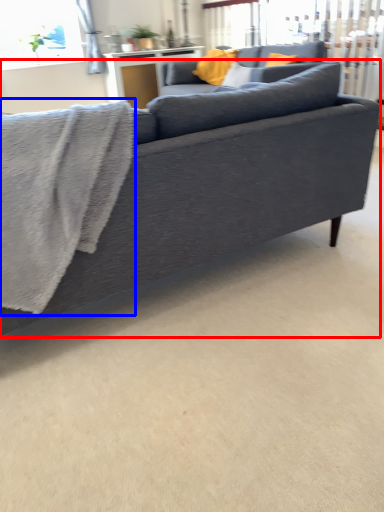
Question: Which point is further to the camera, studio couch (highlighted by a red box) or bath towel (highlighted by a blue box)?

Choices:
 (A) studio couch
 (B) bath towel

Answer: (B)